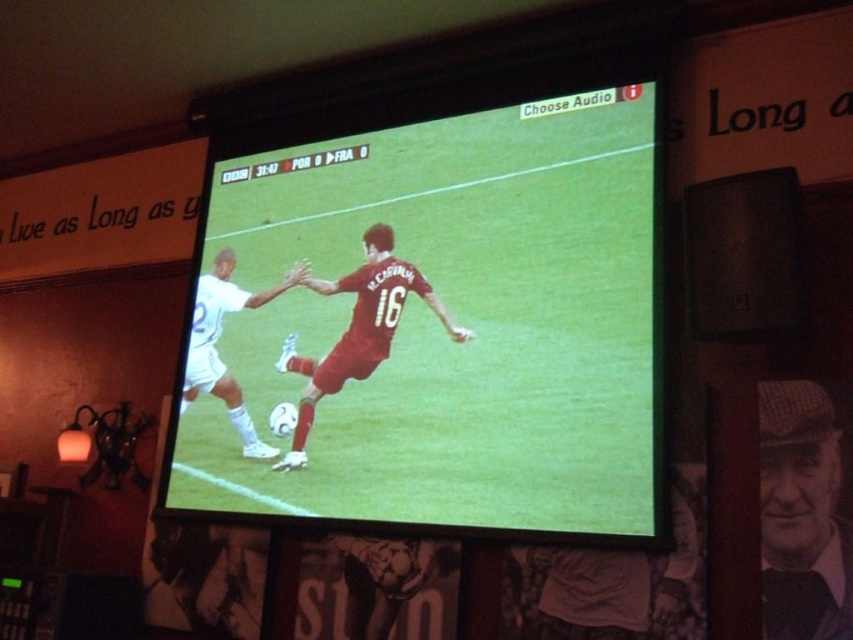
Is matte red soccer ball at center positioned behind red matte soccer player at center?

That is False.

Which is more to the left, matte red soccer ball at center or red matte soccer player at center?

Positioned to the left is red matte soccer player at center.

At what (x,y) coordinates should I click in order to perform the action: click on matte red soccer ball at center. Please return your answer as a coordinate pair (x, y). Image resolution: width=853 pixels, height=640 pixels. Looking at the image, I should click on (440, 316).

Which is in front, point (399, 284) or point (199, 358)?

Point (399, 284) is in front.

What do you see at coordinates (358, 330) in the screenshot?
I see `red matte soccer player at center` at bounding box center [358, 330].

Between point (341, 348) and point (238, 308), which one is positioned behind?

Positioned behind is point (238, 308).

You are a GUI agent. You are given a task and a screenshot of the screen. Output one action in this format:
    pyautogui.click(x=<x>, y=<y>)
    Task: Click on the red matte soccer player at center
    The image size is (853, 640).
    Given the screenshot: What is the action you would take?
    pyautogui.click(x=358, y=330)

Is matte red soccer ball at center closer to the viewer compared to checkered fabric cap at right?

No, it is behind checkered fabric cap at right.

Does matte red soccer ball at center appear on the right side of checkered fabric cap at right?

In fact, matte red soccer ball at center is to the left of checkered fabric cap at right.

Which is behind, point (585, 394) or point (833, 504)?

The point (585, 394) is behind.

Find the location of a particular element. The width and height of the screenshot is (853, 640). matte red soccer ball at center is located at coordinates (440, 316).